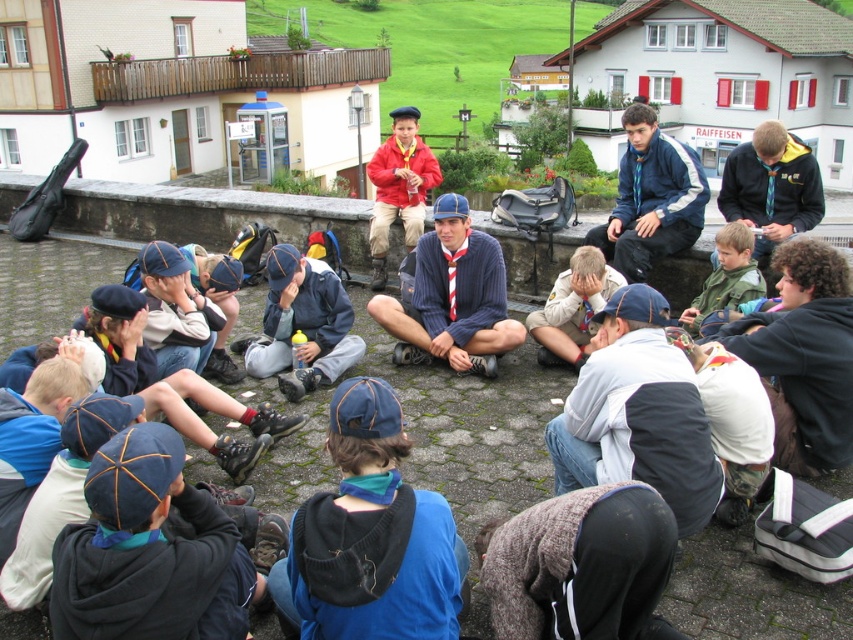
Question: Can you confirm if blue fleece jacket at center is positioned to the left of green matte jacket at center?

Choices:
 (A) yes
 (B) no

Answer: (A)

Question: Which object appears farthest from the camera in this image?

Choices:
 (A) dark blue jacket at center
 (B) curly-haired boy at center

Answer: (A)

Question: Where is white fleece jacket at center located in relation to dark blue jacket at center in the image?

Choices:
 (A) left
 (B) right

Answer: (A)

Question: Which of the following is the farthest from the observer?

Choices:
 (A) (833, 324)
 (B) (552, 454)
 (C) (675, 173)

Answer: (C)

Question: Which is farther from the white fleece jacket at center?

Choices:
 (A) curly-haired boy at center
 (B) matte red jacket at center
 (C) light brown uniform at center
 (D) blue fleece jacket at center

Answer: (B)

Question: Is blue knitted sweater at center wider than green matte jacket at center?

Choices:
 (A) yes
 (B) no

Answer: (A)